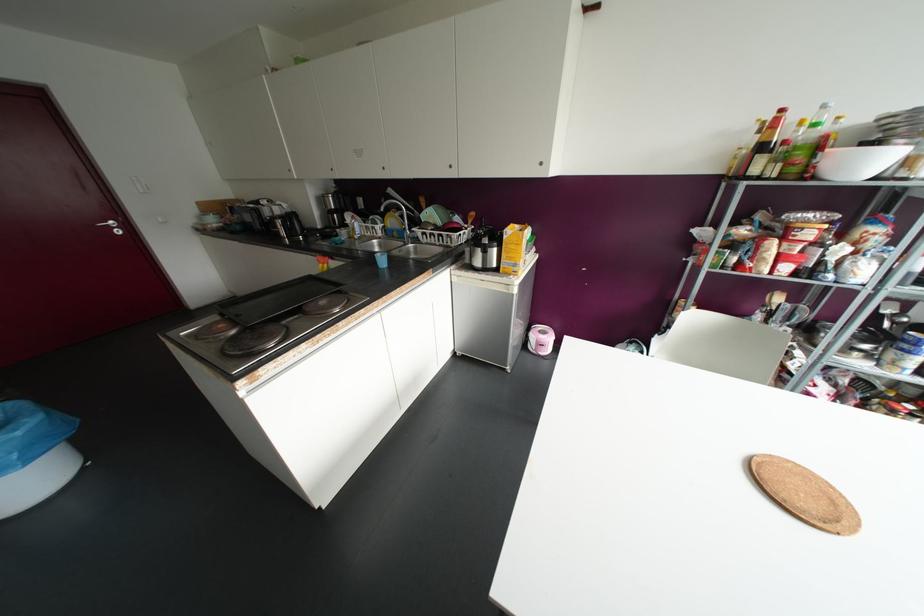
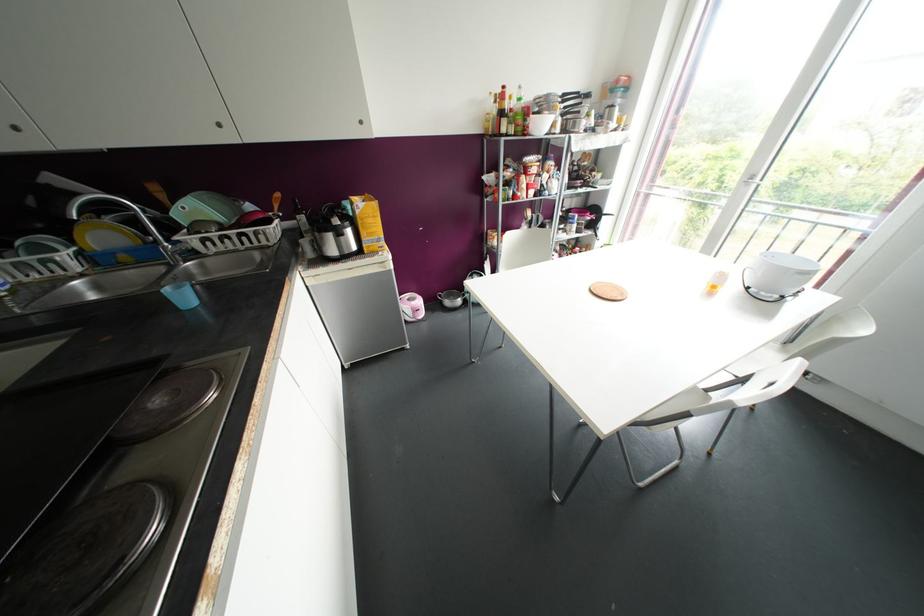
Find the pixel in the second image that matches point 415,238 in the first image.

(192, 253)